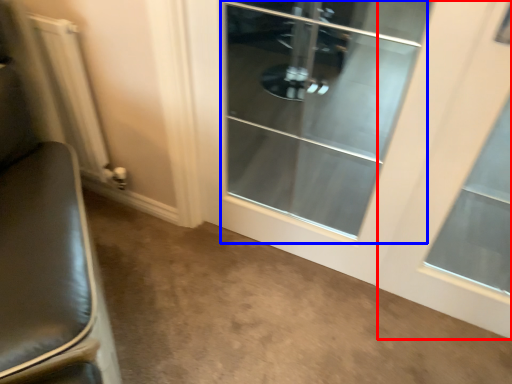
Question: Among these objects, which one is nearest to the camera, window (highlighted by a red box) or screen door (highlighted by a blue box)?

Choices:
 (A) window
 (B) screen door

Answer: (A)